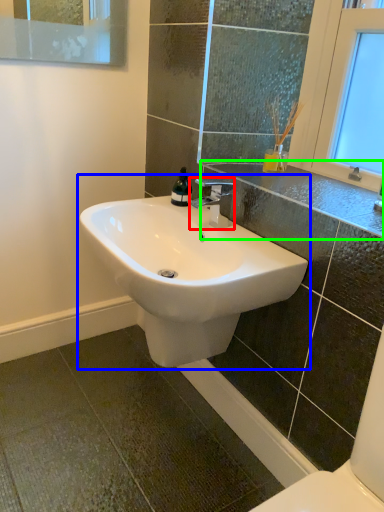
Question: Estimate the real-world distances between objects in this image. Which object is closer to tap (highlighted by a red box), sink (highlighted by a blue box) or counter top (highlighted by a green box)?

Choices:
 (A) sink
 (B) counter top

Answer: (B)